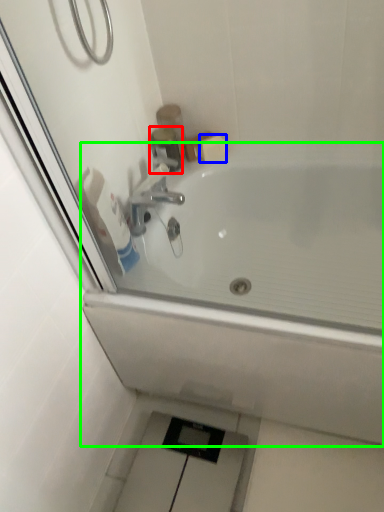
Question: Which object is the closest to the plumbing fixture (highlighted by a red box)? Choose among these: soap (highlighted by a blue box) or bathtub (highlighted by a green box).

Choices:
 (A) soap
 (B) bathtub

Answer: (A)